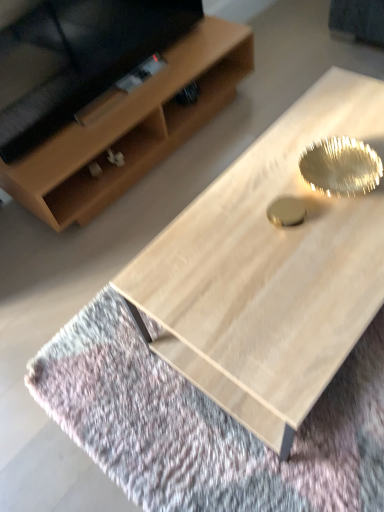
The image size is (384, 512). Find the location of `free point in front of light brown wood shelf at upper left`. free point in front of light brown wood shelf at upper left is located at coordinates (110, 270).